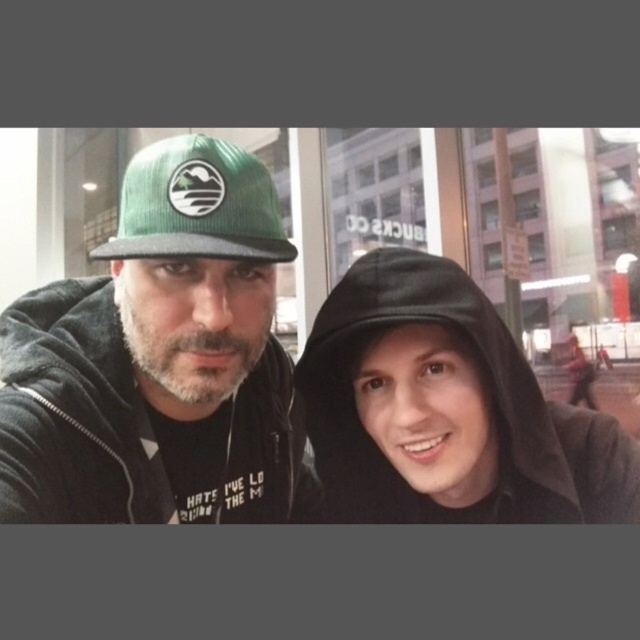
Question: Considering the real-world distances, which object is farthest from the green corduroy cap at upper left?

Choices:
 (A) green corduroy baseball cap at upper left
 (B) black matte hoodie at right

Answer: (B)

Question: Can you confirm if green corduroy cap at upper left is bigger than black matte hoodie at right?

Choices:
 (A) no
 (B) yes

Answer: (B)

Question: Does green corduroy cap at upper left have a smaller size compared to green corduroy baseball cap at upper left?

Choices:
 (A) no
 (B) yes

Answer: (A)

Question: Which of the following is the closest to the observer?

Choices:
 (A) green corduroy cap at upper left
 (B) green corduroy baseball cap at upper left

Answer: (A)

Question: Estimate the real-world distances between objects in this image. Which object is farther from the green corduroy cap at upper left?

Choices:
 (A) green corduroy baseball cap at upper left
 (B) black matte hoodie at right

Answer: (B)

Question: Is black matte hoodie at right below green corduroy baseball cap at upper left?

Choices:
 (A) no
 (B) yes

Answer: (B)